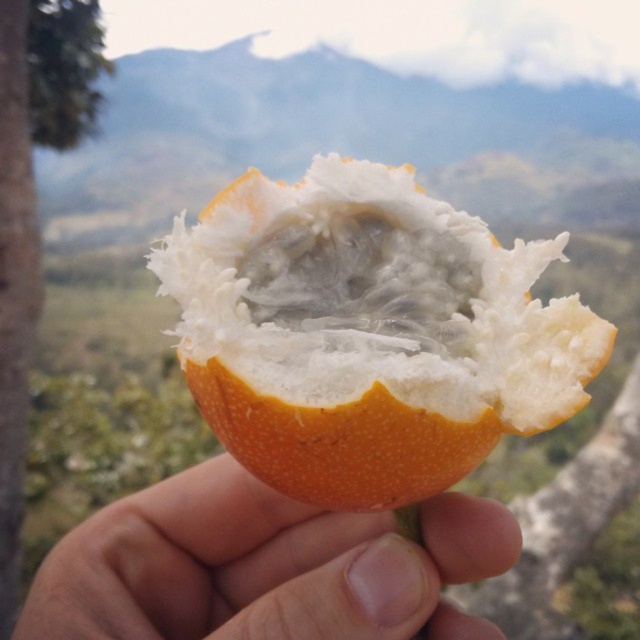
Question: Observing the image, what is the correct spatial positioning of orangetextured/softfruit at center in reference to orange skin at center?

Choices:
 (A) below
 (B) above

Answer: (B)

Question: Which point is closer to the camera?

Choices:
 (A) green rough bark tree at left
 (B) orangetextured/softfruit at center

Answer: (B)

Question: Which object is closer to the camera taking this photo?

Choices:
 (A) orangetextured/softfruit at center
 (B) orange skin at center
 (C) green rough bark tree at left

Answer: (A)

Question: Does orangetextured/softfruit at center have a greater width compared to orange skin at center?

Choices:
 (A) yes
 (B) no

Answer: (B)

Question: Which point is closer to the camera?

Choices:
 (A) green rough bark tree at left
 (B) orange skin at center
 (C) orangetextured/softfruit at center

Answer: (C)

Question: Does orange skin at center appear over green rough bark tree at left?

Choices:
 (A) yes
 (B) no

Answer: (B)